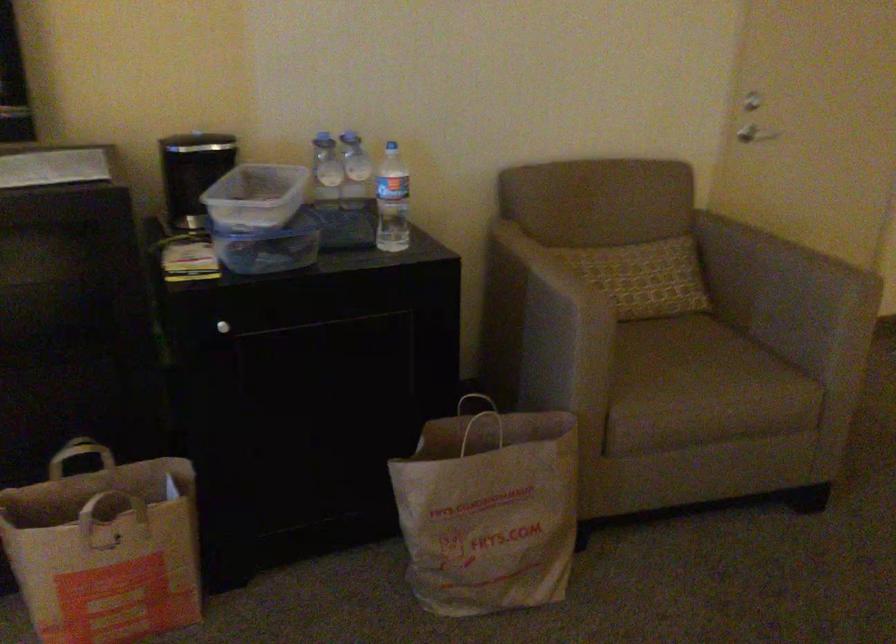
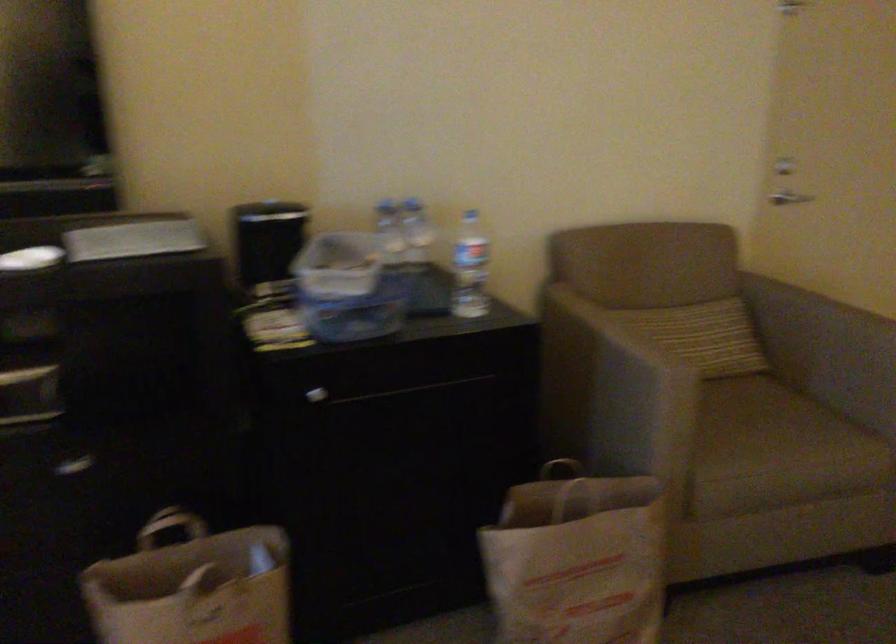
In the second image, find the point that corresponds to point 691,359 in the first image.

(762, 418)